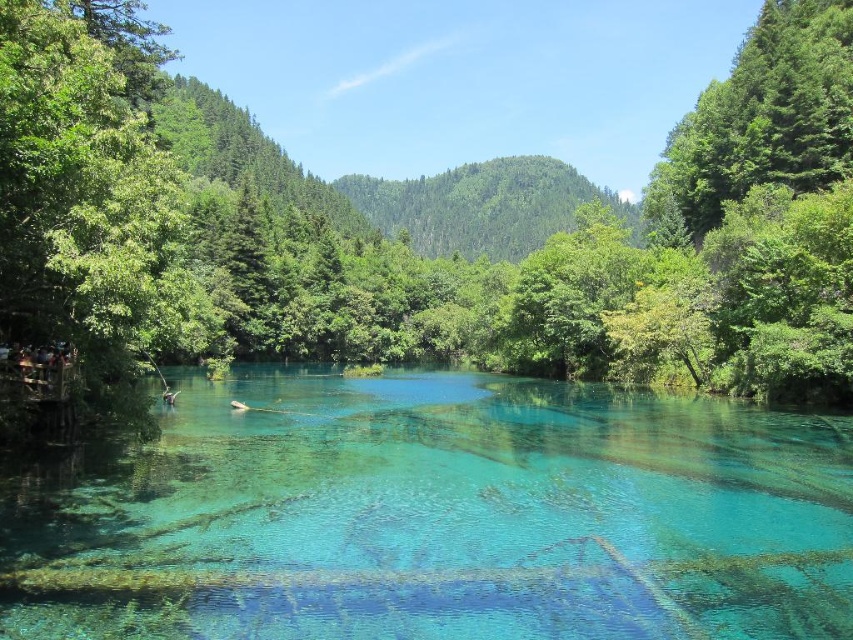
You are standing at the center of the scene and looking towards the green leafy tree at left and the green leafy tree at upper right. Which tree appears taller from your current position?

The green leafy tree at upper right appears taller because it has a greater height compared to the green leafy tree at left.

You are standing at the edge of the lake and see two points in the water. One is at point coordinate [798,100] and the other is at point coordinate [294,404]. Which point is closer to you?

Point coordinate [798,100] is closer to you because it is further to the viewer than point coordinate [294,404].

You are an environmental scientist observing the scene. You need to determine which area covers more space in the image between the translucent blue water at center and the green leafy tree at left. Based on the scene, which one takes up more area?

The green leafy tree at left occupies more space than the translucent blue water at center in the image.